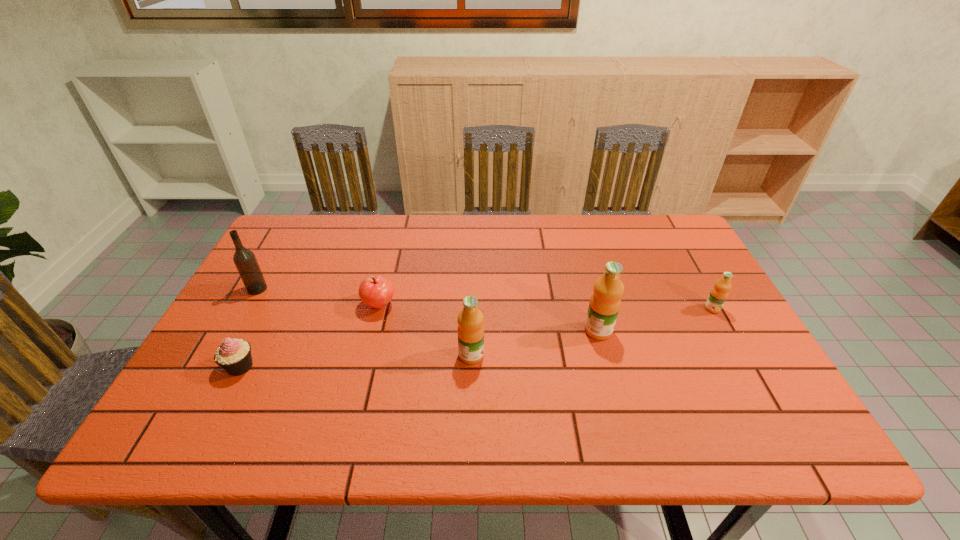
Find the location of a particular element. free space between the fourth object from left to right and the vodka is located at coordinates (365, 322).

Find the location of a particular element. Image resolution: width=960 pixels, height=540 pixels. unoccupied area between the rightmost object and the vodka is located at coordinates (485, 299).

Where is `object that can be found as the second closest to the second orange juice from right to left`? This screenshot has width=960, height=540. object that can be found as the second closest to the second orange juice from right to left is located at coordinates (719, 293).

The height and width of the screenshot is (540, 960). Find the location of `object that is the closest to the farthest orange juice`. object that is the closest to the farthest orange juice is located at coordinates (605, 301).

Find the location of a particular element. the second closest orange juice to the farthest orange juice is located at coordinates (470, 319).

Identify which orange juice is the second nearest to the nearest orange juice. Please provide its 2D coordinates. Your answer should be formatted as a tuple, i.e. [(x, y)], where the tuple contains the x and y coordinates of a point satisfying the conditions above.

[(719, 293)]